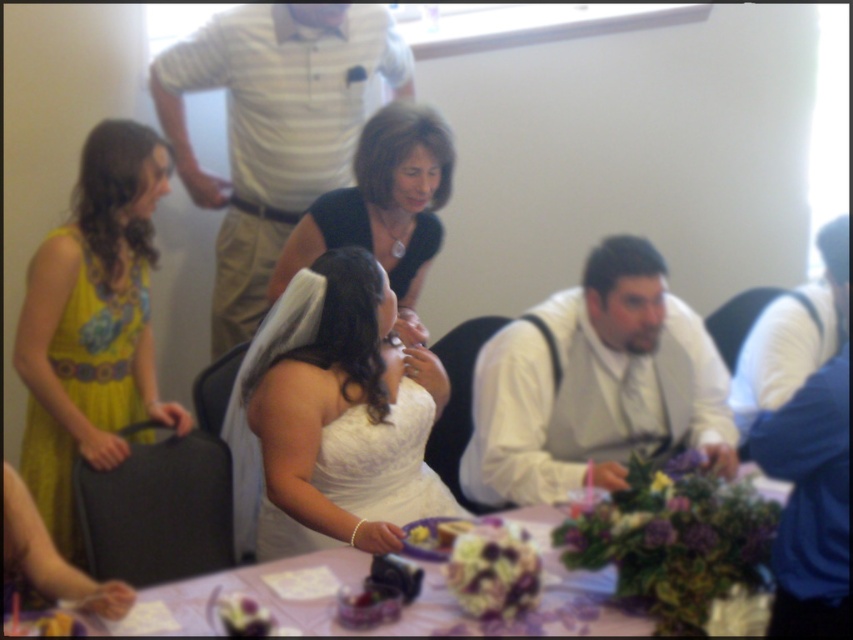
You are a photographer at the wedding reception. You need to take a group photo of the guests. The white shirt at upper center and the yellow floral fabric dress at left are both in your frame. Which one should you focus on first if you want to ensure the larger subject is in focus?

The white shirt at upper center is larger compared to the yellow floral fabric dress at left, so you should focus on the white shirt at upper center first to ensure the larger subject is in focus.

You are a photographer at the wedding reception and need to position a camera stand between the white shirt at upper center and the yellow floral fabric dress at left. Considering their widths, which object requires more space to avoid blocking the camera view?

The white shirt at upper center requires more space because its width is larger than the yellow floral fabric dress at left, so positioning the camera stand around it would need more clearance to avoid obstruction.